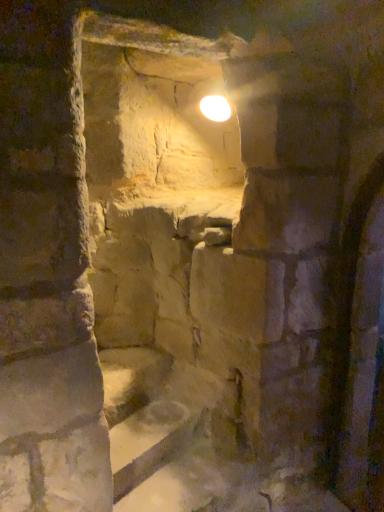
Question: Is white glossy light bulb at upper center wider or thinner than smooth stone stairs at lower center?

Choices:
 (A) thin
 (B) wide

Answer: (A)

Question: From a real-world perspective, is white glossy light bulb at upper center physically located above or below smooth stone stairs at lower center?

Choices:
 (A) above
 (B) below

Answer: (A)

Question: In terms of height, does white glossy light bulb at upper center look taller or shorter compared to smooth stone stairs at lower center?

Choices:
 (A) short
 (B) tall

Answer: (B)

Question: In terms of height, does smooth stone stairs at lower center look taller or shorter compared to white glossy light bulb at upper center?

Choices:
 (A) short
 (B) tall

Answer: (A)

Question: Does point (114, 373) appear closer or farther from the camera than point (211, 103)?

Choices:
 (A) farther
 (B) closer

Answer: (B)

Question: From the image's perspective, relative to white glossy light bulb at upper center, is smooth stone stairs at lower center above or below?

Choices:
 (A) below
 (B) above

Answer: (A)

Question: Is smooth stone stairs at lower center bigger or smaller than white glossy light bulb at upper center?

Choices:
 (A) small
 (B) big

Answer: (B)